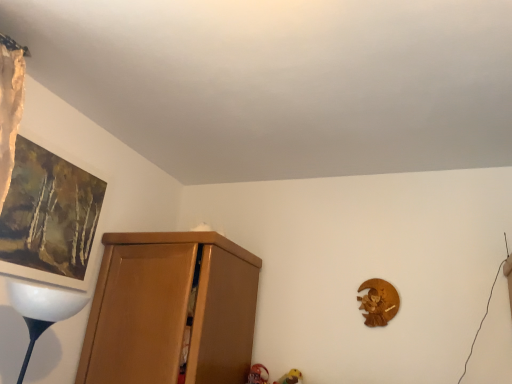
Question: Can you confirm if matte brown picture frame at upper left is positioned to the left of matte wood cupboard at left?

Choices:
 (A) yes
 (B) no

Answer: (A)

Question: Can you confirm if matte brown picture frame at upper left is positioned to the right of matte wood cupboard at left?

Choices:
 (A) no
 (B) yes

Answer: (A)

Question: Does matte brown picture frame at upper left have a greater width compared to matte wood cupboard at left?

Choices:
 (A) no
 (B) yes

Answer: (A)

Question: Does matte brown picture frame at upper left turn towards matte wood cupboard at left?

Choices:
 (A) yes
 (B) no

Answer: (B)

Question: Is matte brown picture frame at upper left with matte wood cupboard at left?

Choices:
 (A) no
 (B) yes

Answer: (A)

Question: From the image's perspective, is matte brown picture frame at upper left over matte wood cupboard at left?

Choices:
 (A) no
 (B) yes

Answer: (B)

Question: From a real-world perspective, is matte wood cupboard at left on matte brown picture frame at upper left?

Choices:
 (A) yes
 (B) no

Answer: (B)

Question: Is matte wood cupboard at left bigger than matte brown picture frame at upper left?

Choices:
 (A) yes
 (B) no

Answer: (A)

Question: Is matte wood cupboard at left shorter than matte brown picture frame at upper left?

Choices:
 (A) yes
 (B) no

Answer: (B)

Question: Is there a large distance between matte wood cupboard at left and matte brown picture frame at upper left?

Choices:
 (A) no
 (B) yes

Answer: (A)

Question: Is matte wood cupboard at left surrounding matte brown picture frame at upper left?

Choices:
 (A) yes
 (B) no

Answer: (B)

Question: Can you confirm if matte wood cupboard at left is thinner than matte brown picture frame at upper left?

Choices:
 (A) no
 (B) yes

Answer: (A)

Question: In terms of height, does matte wood cupboard at left look taller or shorter compared to matte brown picture frame at upper left?

Choices:
 (A) tall
 (B) short

Answer: (A)